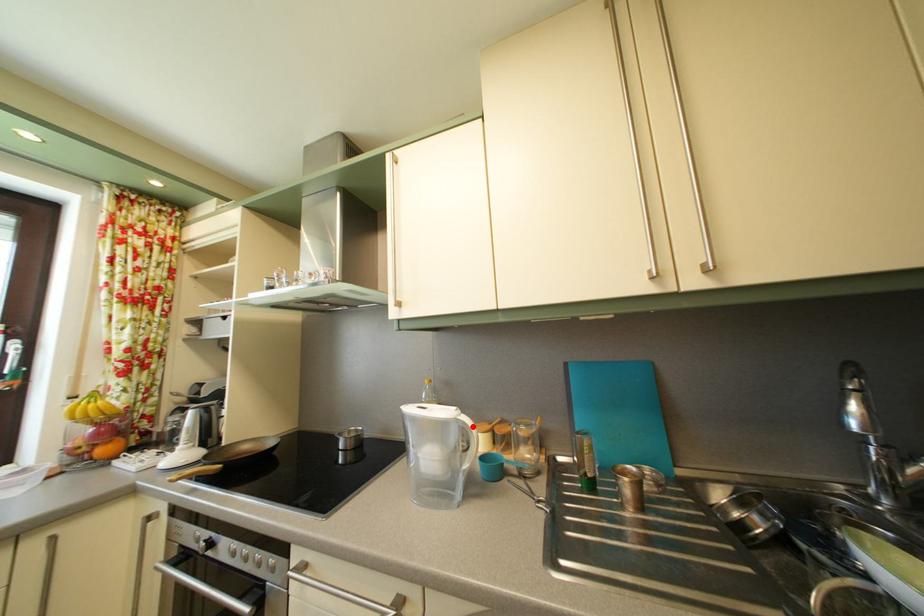
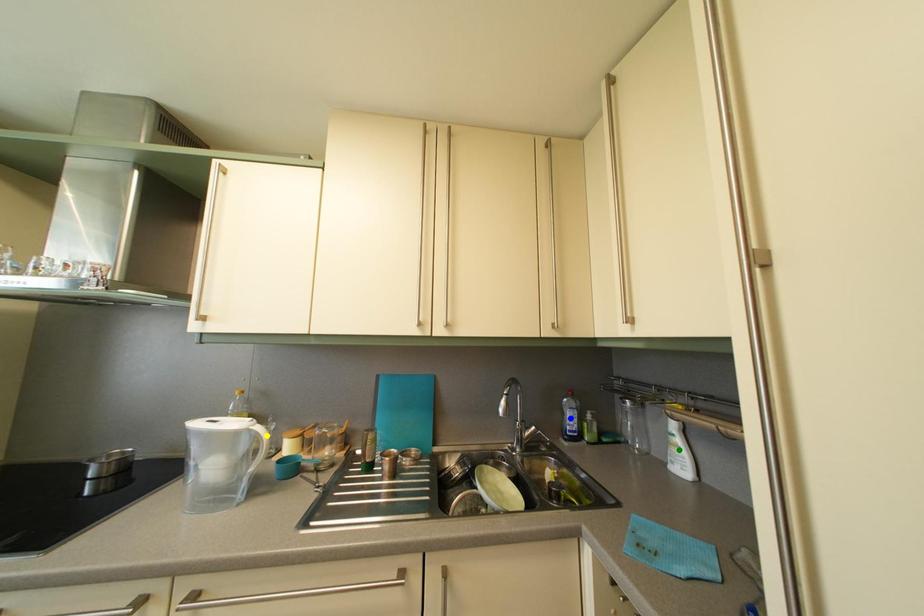
Question: I am providing you with two images of the same scene from different viewpoints. A red point is marked on the first image. You are given multiple points on the second image. Which point in image 2 is actually the same real-world point as the red point in image 1?

Choices:
 (A) blue point
 (B) yellow point
 (C) green point

Answer: (B)